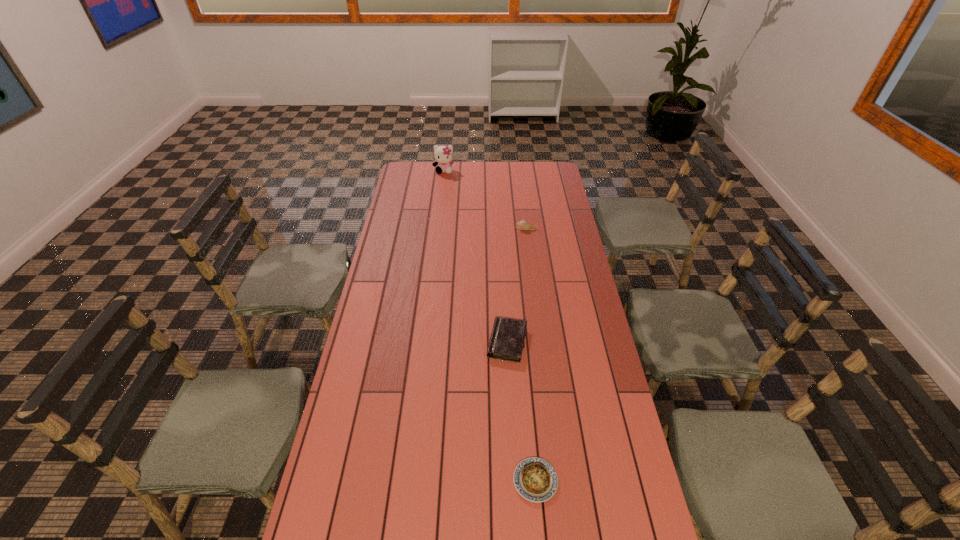
Locate an element on the screen. vacant space that satisfies the following two spatial constraints: 1. on the shell of the escargot; 2. on the front side of the nearest object is located at coordinates (558, 481).

You are a GUI agent. You are given a task and a screenshot of the screen. Output one action in this format:
    pyautogui.click(x=<x>, y=<y>)
    Task: Click on the free space that satisfies the following two spatial constraints: 1. on the front-facing side of the leftmost object; 2. on the left side of the diary
    
    Given the screenshot: What is the action you would take?
    pyautogui.click(x=424, y=342)